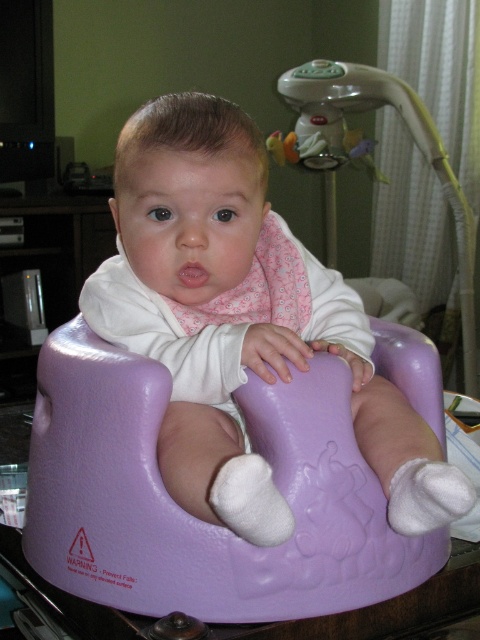
Is matte purple bouncer at center smaller than purple glossy baby seat at center?

Incorrect, matte purple bouncer at center is not smaller in size than purple glossy baby seat at center.

Is matte purple bouncer at center further to the viewer compared to purple glossy baby seat at center?

No, matte purple bouncer at center is closer to the viewer.

Is point (223, 193) closer to viewer compared to point (244, 419)?

No, (223, 193) is further to viewer.

This screenshot has height=640, width=480. I want to click on matte purple bouncer at center, so click(x=241, y=321).

What do you see at coordinates (190, 515) in the screenshot? I see `purple glossy baby seat at center` at bounding box center [190, 515].

Is purple glossy baby seat at center shorter than plastic baby swing at upper center?

Correct, purple glossy baby seat at center is not as tall as plastic baby swing at upper center.

The height and width of the screenshot is (640, 480). Describe the element at coordinates (190, 515) in the screenshot. I see `purple glossy baby seat at center` at that location.

Locate an element on the screen. purple glossy baby seat at center is located at coordinates (190, 515).

Who is more forward, (372, 413) or (287, 97)?

Positioned in front is point (372, 413).

Which of these two, matte purple bouncer at center or plastic baby swing at upper center, stands shorter?

matte purple bouncer at center

The width and height of the screenshot is (480, 640). What are the coordinates of `matte purple bouncer at center` in the screenshot? It's located at (241, 321).

Locate an element on the screen. The height and width of the screenshot is (640, 480). matte purple bouncer at center is located at coordinates (241, 321).